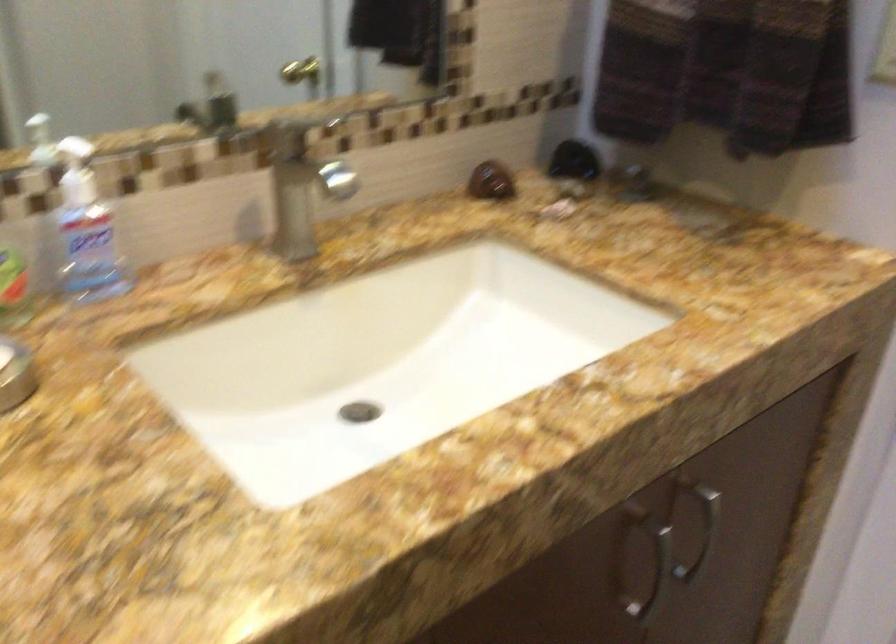
What do you see at coordinates (295, 136) in the screenshot?
I see `the faucet handle` at bounding box center [295, 136].